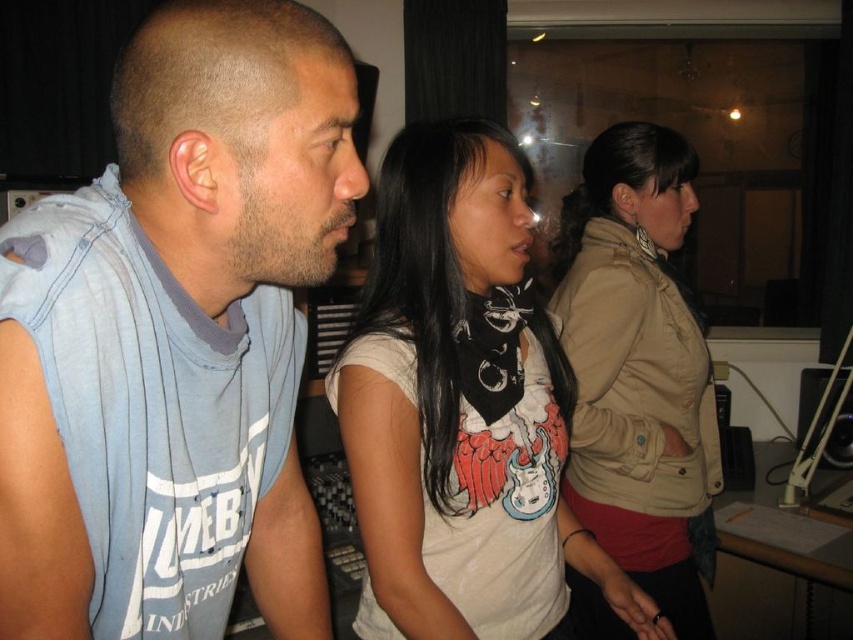
From the picture: Between light blue sleeveless shirt at left and white matte t-shirt at center, which one appears on the left side from the viewer's perspective?

light blue sleeveless shirt at left

Does point (190, 362) come behind point (390, 161)?

No, (190, 362) is in front of (390, 161).

Image resolution: width=853 pixels, height=640 pixels. Find the location of `light blue sleeveless shirt at left`. light blue sleeveless shirt at left is located at coordinates (183, 324).

Is white matte t-shirt at center shorter than tan leather jacket at center?

Indeed, white matte t-shirt at center has a lesser height compared to tan leather jacket at center.

What do you see at coordinates (462, 408) in the screenshot? I see `white matte t-shirt at center` at bounding box center [462, 408].

Does point (514, 518) lie behind point (646, 301)?

No, it is not.

Identify the location of white matte t-shirt at center. (462, 408).

Does point (13, 368) come closer to viewer compared to point (578, 328)?

That is True.

Between light blue sleeveless shirt at left and tan leather jacket at center, which one has more height?

tan leather jacket at center

Is point (300, 260) farther from camera compared to point (699, 480)?

No, (300, 260) is closer to viewer.

The width and height of the screenshot is (853, 640). What are the coordinates of `light blue sleeveless shirt at left` in the screenshot? It's located at (183, 324).